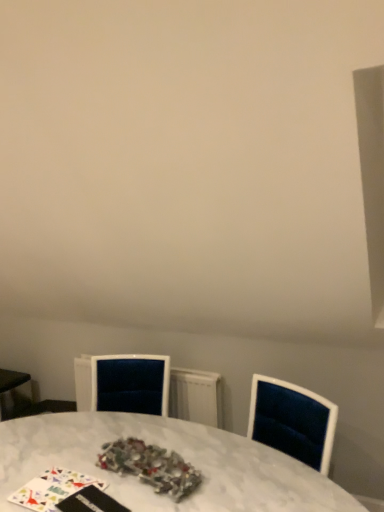
The height and width of the screenshot is (512, 384). Identify the location of unoccupied space behind shiny metallic tinsel at center. (142, 431).